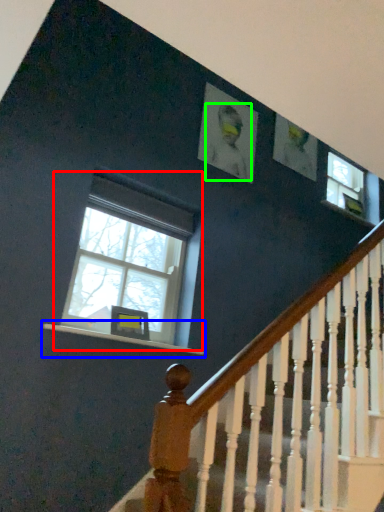
Question: Which is nearer to the window (highlighted by a red box)? window sill (highlighted by a blue box) or person (highlighted by a green box).

Choices:
 (A) window sill
 (B) person

Answer: (A)